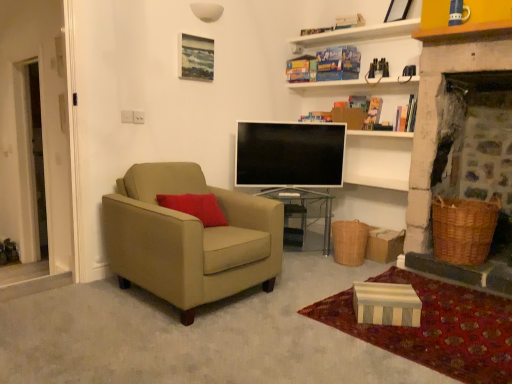
What are the coordinates of `vacant space to the left of suede beige armchair at left` in the screenshot? It's located at (70, 301).